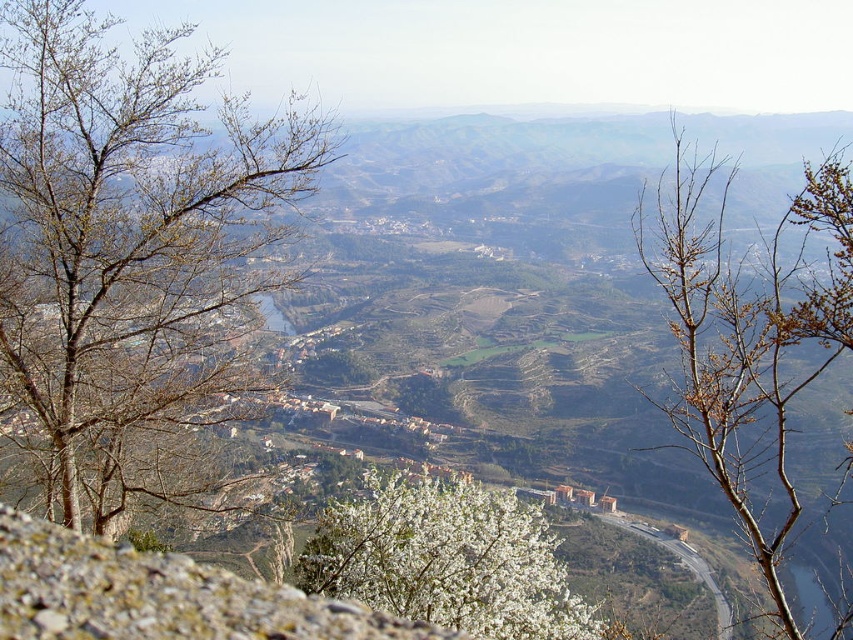
Between point (33, 458) and point (648, 218), which one is positioned behind?

Point (648, 218)

Does bare branches at left have a lesser height compared to bare branches at upper center?

Yes, bare branches at left is shorter than bare branches at upper center.

Is point (198, 221) less distant than point (750, 368)?

No, it is behind (750, 368).

This screenshot has height=640, width=853. I want to click on bare branches at left, so click(x=132, y=260).

Is bare branches at upper center further to camera compared to white blossoming bush at center?

That is False.

Describe the element at coordinates (733, 346) in the screenshot. I see `bare branches at upper center` at that location.

I want to click on bare branches at upper center, so click(733, 346).

Identify the location of bare branches at left. The width and height of the screenshot is (853, 640). (132, 260).

Which of these two, bare branches at left or white blossoming bush at center, stands shorter?

white blossoming bush at center is shorter.

The image size is (853, 640). What do you see at coordinates (132, 260) in the screenshot?
I see `bare branches at left` at bounding box center [132, 260].

Locate an element on the screen. bare branches at left is located at coordinates (132, 260).